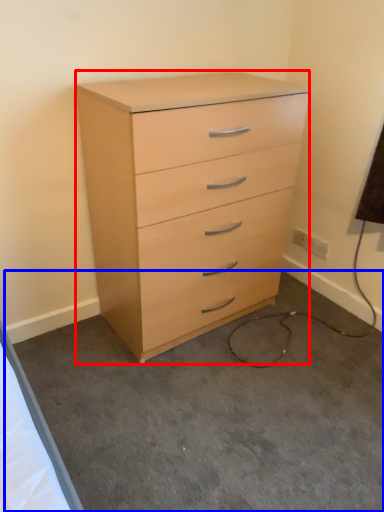
Question: Among these objects, which one is farthest to the camera, chest of drawers (highlighted by a red box) or concrete (highlighted by a blue box)?

Choices:
 (A) chest of drawers
 (B) concrete

Answer: (A)